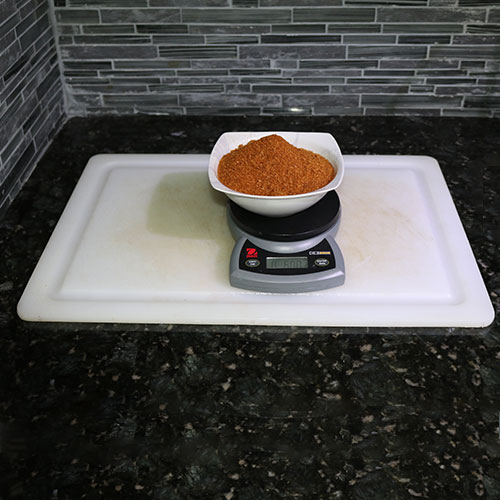
The height and width of the screenshot is (500, 500). In order to click on white bowl in this screenshot , I will do `click(276, 202)`.